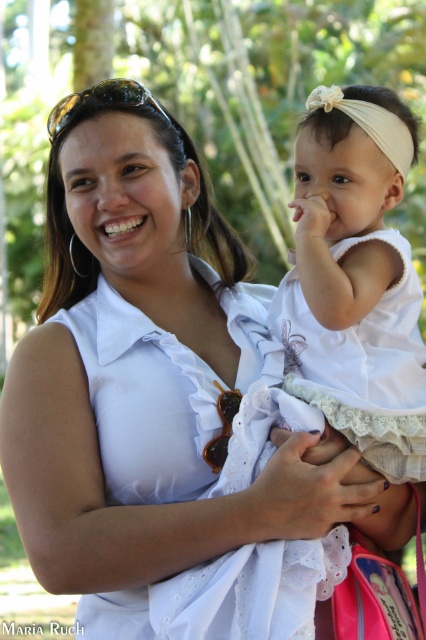
Is point (342, 109) positioned in front of point (367, 88)?

Yes.

Does white lace dress at center have a larger size compared to beige fabric headband at upper center?

Yes, white lace dress at center is bigger than beige fabric headband at upper center.

Does point (368, 196) lie behind point (389, 152)?

Yes.

Where is `white lace dress at center`? The height and width of the screenshot is (640, 426). white lace dress at center is located at coordinates (356, 278).